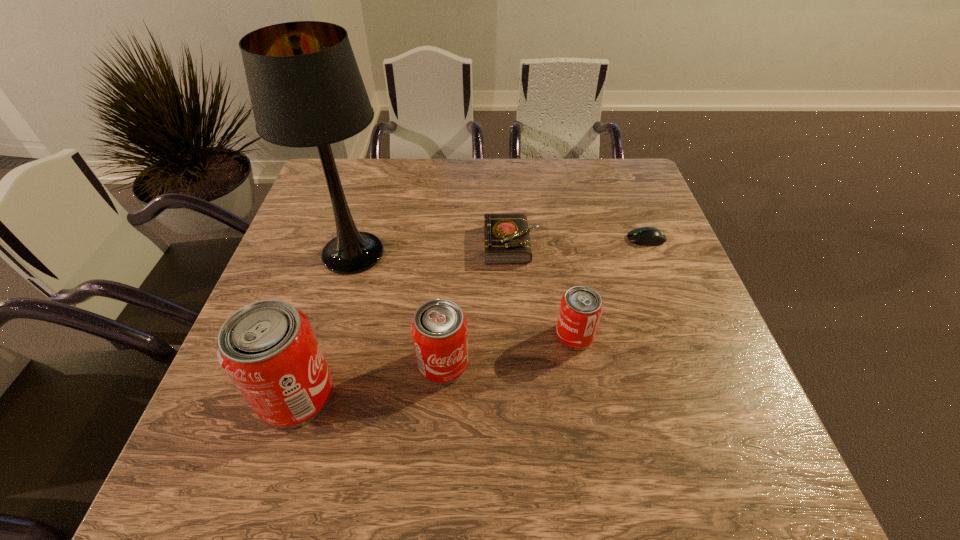
Where is `free space between the tallest can and the rightmost object`? free space between the tallest can and the rightmost object is located at coordinates (471, 317).

The height and width of the screenshot is (540, 960). I want to click on vacant space in between the second tallest object and the rightmost object, so click(471, 317).

Where is `vacant area that lies between the shortest object and the rightmost can`? The width and height of the screenshot is (960, 540). vacant area that lies between the shortest object and the rightmost can is located at coordinates 611,287.

Where is `vacant region between the second tallest object and the second can from right to left`? vacant region between the second tallest object and the second can from right to left is located at coordinates (370, 380).

The width and height of the screenshot is (960, 540). In order to click on vacant space in between the tallest can and the second shortest can in this screenshot , I will do `click(370, 380)`.

Select which object appears as the fourth closest to the fifth tallest object. Please provide its 2D coordinates. Your answer should be formatted as a tuple, i.e. [(x, y)], where the tuple contains the x and y coordinates of a point satisfying the conditions above.

[(439, 328)]

Identify which object is located as the fifth nearest to the table lamp. Please provide its 2D coordinates. Your answer should be formatted as a tuple, i.e. [(x, y)], where the tuple contains the x and y coordinates of a point satisfying the conditions above.

[(647, 236)]

Identify the location of can identified as the second closest to the tallest can. (581, 307).

This screenshot has width=960, height=540. I want to click on the closest can to the second can from left to right, so pyautogui.click(x=268, y=348).

At what (x,y) coordinates should I click in order to perform the action: click on free space that satisfies the following two spatial constraints: 1. on the wheel side of the shortest object; 2. on the front side of the leftmost can. Please return your answer as a coordinate pair (x, y). Image resolution: width=960 pixels, height=540 pixels. Looking at the image, I should click on (708, 395).